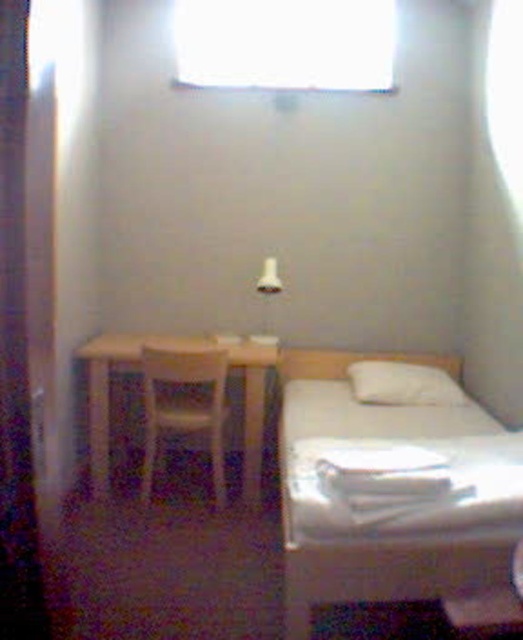
In the scene shown: You are trying to place a new plant pot on the floor between the transparent glass window at upper center and the white plastic chair at left. Based on their positions, which object is directly above the other?

The transparent glass window at upper center is positioned over the white plastic chair at left, meaning the window is above the chair.

You are sitting on the white plastic chair at left and want to look out the transparent glass window at upper center. Which direction should you turn your head to face the window?

The transparent glass window at upper center is positioned on the right side of white plastic chair at left, so you should turn your head to the right to face the window.

You are moving into this room and need to place a new rectangular rug that must fit between the white smooth bed at center and the white plastic chair at left. The rug is exactly as wide as the narrower of the two objects. Which object determines the rug width, and will the rug fit between them?

The white plastic chair at left is narrower than the white smooth bed at center. The rug, matching the chair width, will fit between them since the bed is wider but the space between them isn